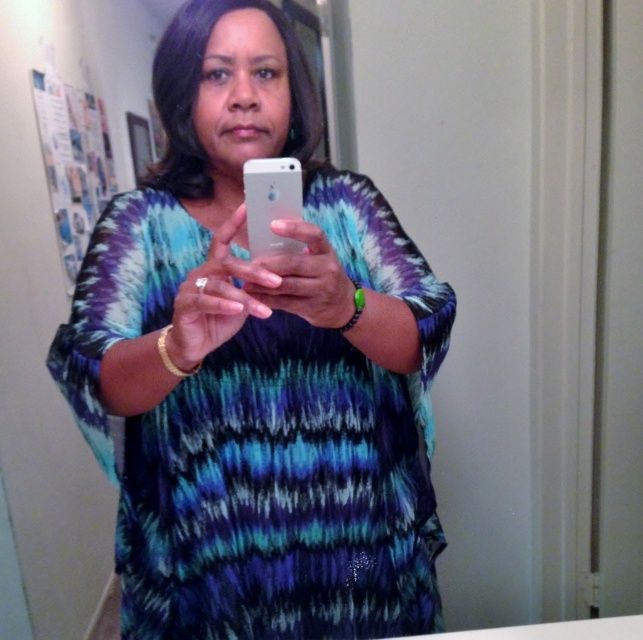
Is point (275, 634) behind point (285, 198)?

That is True.

Between matte tie-dye blouse at center and silver metallic phone at center, which one appears on the right side from the viewer's perspective?

silver metallic phone at center is more to the right.

Locate an element on the screen. This screenshot has height=640, width=643. matte tie-dye blouse at center is located at coordinates (257, 365).